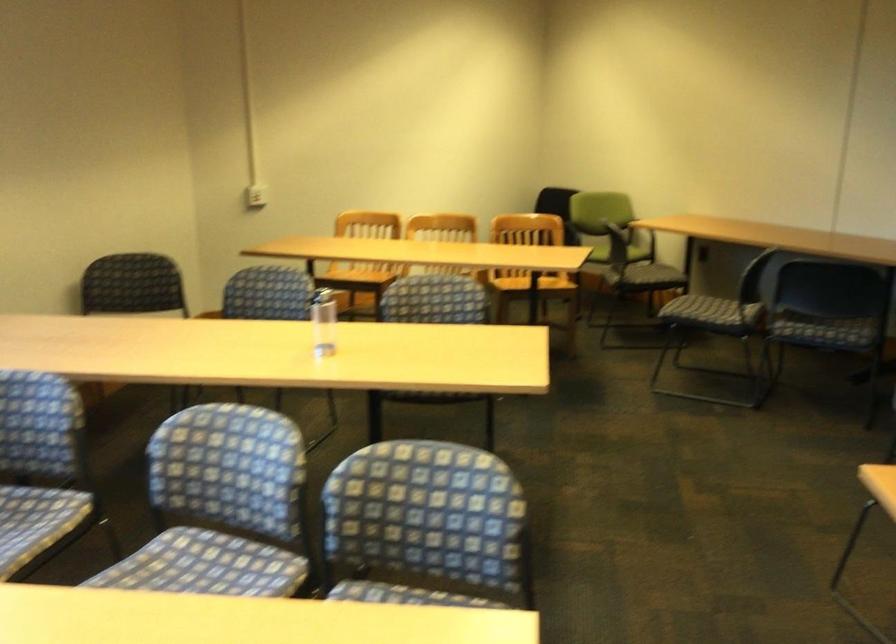
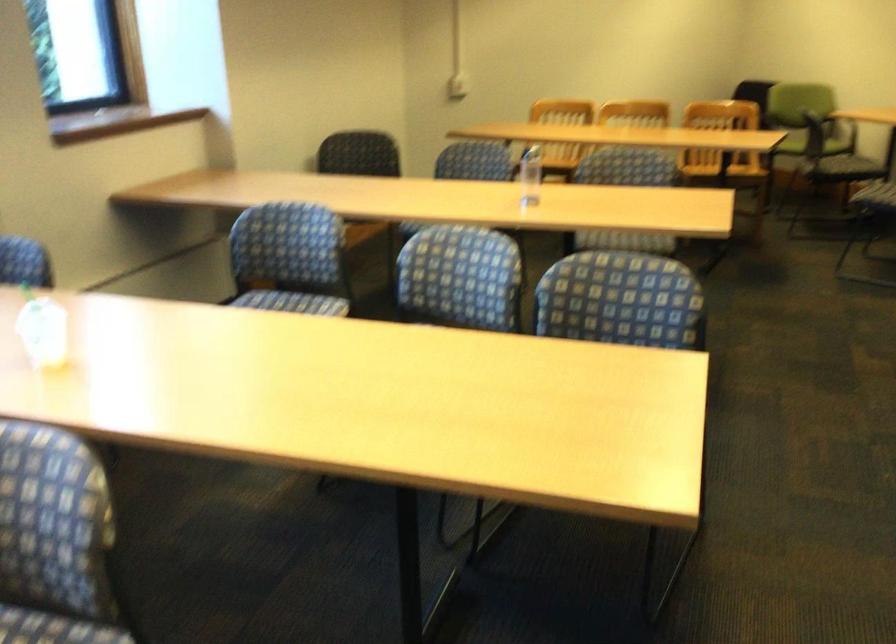
Question: The images are taken continuously from a first-person perspective. In which direction are you moving?

Choices:
 (A) Left
 (B) Right
 (C) Forward
 (D) Backward

Answer: (D)